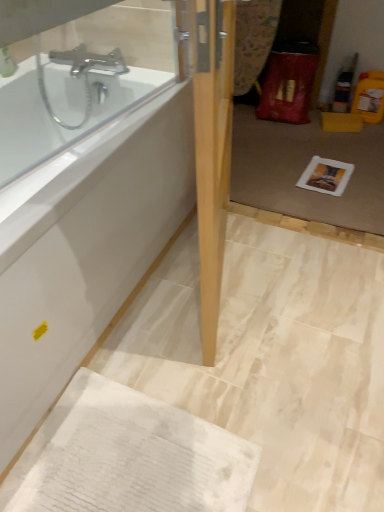
Describe the element at coordinates (212, 146) in the screenshot. The height and width of the screenshot is (512, 384). I see `light wood door at center` at that location.

What is the approximate width of white glossy bathtub at upper left?

white glossy bathtub at upper left is 72.59 centimeters wide.

At what (x,y) coordinates should I click in order to perform the action: click on light wood door at center. Please return your answer as a coordinate pair (x, y). This screenshot has width=384, height=512. Looking at the image, I should click on (212, 146).

How different are the orientations of light wood door at center and white glossy bathtub at upper left in degrees?

18 degrees.

Considering the positions of objects light wood door at center and white glossy bathtub at upper left in the image provided, who is more to the right, light wood door at center or white glossy bathtub at upper left?

light wood door at center.

From a real-world perspective, is light wood door at center physically located above or below white glossy bathtub at upper left?

light wood door at center is situated higher than white glossy bathtub at upper left in the real world.

Which is behind, light wood door at center or white glossy bathtub at upper left?

white glossy bathtub at upper left is further from the camera.

Does white textured towel at lower left have a greater width compared to white paper at center?

Yes, white textured towel at lower left is wider than white paper at center.

Between white textured towel at lower left and white paper at center, which one has larger size?

Bigger between the two is white textured towel at lower left.

From a real-world perspective, is white textured towel at lower left on white paper at center?

Indeed, from a real-world perspective, white textured towel at lower left stands above white paper at center.

From the image's perspective, between white glossy bathtub at upper left and light wood door at center, which one is located above?

light wood door at center is shown above in the image.

From a real-world perspective, is white glossy bathtub at upper left under light wood door at center?

Yes, from a real-world perspective, white glossy bathtub at upper left is beneath light wood door at center.

Could you tell me if white glossy bathtub at upper left is turned towards light wood door at center?

Yes, white glossy bathtub at upper left faces towards light wood door at center.

Which is behind, white glossy bathtub at upper left or light wood door at center?

white glossy bathtub at upper left is further away from the camera.

Where is `cardboard lying on the left of white paper at center`? Image resolution: width=384 pixels, height=512 pixels. cardboard lying on the left of white paper at center is located at coordinates (128, 457).

Do you think white paper at center is within white textured towel at lower left, or outside of it?

white paper at center is located beyond the bounds of white textured towel at lower left.

Considering the relative sizes of white paper at center and white textured towel at lower left in the image provided, is white paper at center bigger than white textured towel at lower left?

Incorrect, white paper at center is not larger than white textured towel at lower left.

Consider the image. Is white paper at center with white textured towel at lower left?

There is a gap between white paper at center and white textured towel at lower left.

Looking at the image, does white glossy bathtub at upper left seem bigger or smaller compared to transparent glass door at center?

white glossy bathtub at upper left is bigger than transparent glass door at center.

Based on the photo, which is more to the left, white glossy bathtub at upper left or transparent glass door at center?

white glossy bathtub at upper left.

Is white glossy bathtub at upper left taller or shorter than transparent glass door at center?

In the image, white glossy bathtub at upper left appears to be shorter than transparent glass door at center.

Considering the sizes of objects white textured towel at lower left and white glossy bathtub at upper left in the image provided, who is smaller, white textured towel at lower left or white glossy bathtub at upper left?

With smaller size is white textured towel at lower left.

Is white textured towel at lower left inside the boundaries of white glossy bathtub at upper left, or outside?

white textured towel at lower left is outside white glossy bathtub at upper left.

You are a GUI agent. You are given a task and a screenshot of the screen. Output one action in this format:
    pyautogui.click(x=<x>, y=<y>)
    Task: Click on the bathtub above the white textured towel at lower left (from the image's perspective)
    
    Given the screenshot: What is the action you would take?
    pyautogui.click(x=87, y=251)

Is white textured towel at lower left in front of or behind white glossy bathtub at upper left in the image?

Clearly, white textured towel at lower left is behind white glossy bathtub at upper left.

Considering the positions of objects light wood door at center and transparent glass door at center in the image provided, who is more to the right, light wood door at center or transparent glass door at center?

transparent glass door at center.

Who is taller, light wood door at center or transparent glass door at center?

light wood door at center.

Does light wood door at center have a greater width compared to transparent glass door at center?

Incorrect, the width of light wood door at center does not surpass that of transparent glass door at center.

Is transparent glass door at center located within light wood door at center?

That's incorrect, transparent glass door at center is not inside light wood door at center.

At what (x,y) coordinates should I click in order to perform the action: click on door located on the right of white glossy bathtub at upper left. Please return your answer as a coordinate pair (x, y). This screenshot has width=384, height=512. Looking at the image, I should click on (212, 146).

I want to click on copy behind the white textured towel at lower left, so click(326, 176).

Based on their spatial positions, is light wood door at center or transparent glass door at center closer to white paper at center?

transparent glass door at center lies closer to white paper at center than the other object.

Estimate the real-world distances between objects in this image. Which object is further from white glossy bathtub at upper left, light wood door at center or white paper at center?

white paper at center.

Estimate the real-world distances between objects in this image. Which object is closer to white textured towel at lower left, light wood door at center or white paper at center?

Based on the image, light wood door at center appears to be nearer to white textured towel at lower left.

When comparing their distances from white paper at center, does transparent glass door at center or white glossy bathtub at upper left seem closer?

The object closer to white paper at center is transparent glass door at center.

In the scene shown: Based on their spatial positions, is transparent glass door at center or light wood door at center closer to white paper at center?

The object closer to white paper at center is transparent glass door at center.

Estimate the real-world distances between objects in this image. Which object is closer to transparent glass door at center, white glossy bathtub at upper left or white textured towel at lower left?

white glossy bathtub at upper left is positioned closer to the anchor transparent glass door at center.

When comparing their distances from transparent glass door at center, does light wood door at center or white textured towel at lower left seem further?

white textured towel at lower left is positioned further to the anchor transparent glass door at center.

Looking at the image, which one is located further to white glossy bathtub at upper left, white paper at center or transparent glass door at center?

Based on the image, white paper at center appears to be further to white glossy bathtub at upper left.

The image size is (384, 512). I want to click on bathtub between light wood door at center and white textured towel at lower left from top to bottom, so click(87, 251).

Locate an element on the screen. glass door positioned between light wood door at center and white paper at center from near to far is located at coordinates (304, 168).

I want to click on glass door located between white textured towel at lower left and white paper at center in the depth direction, so click(304, 168).

This screenshot has width=384, height=512. I want to click on door between transparent glass door at center and white textured towel at lower left in the up-down direction, so click(x=212, y=146).